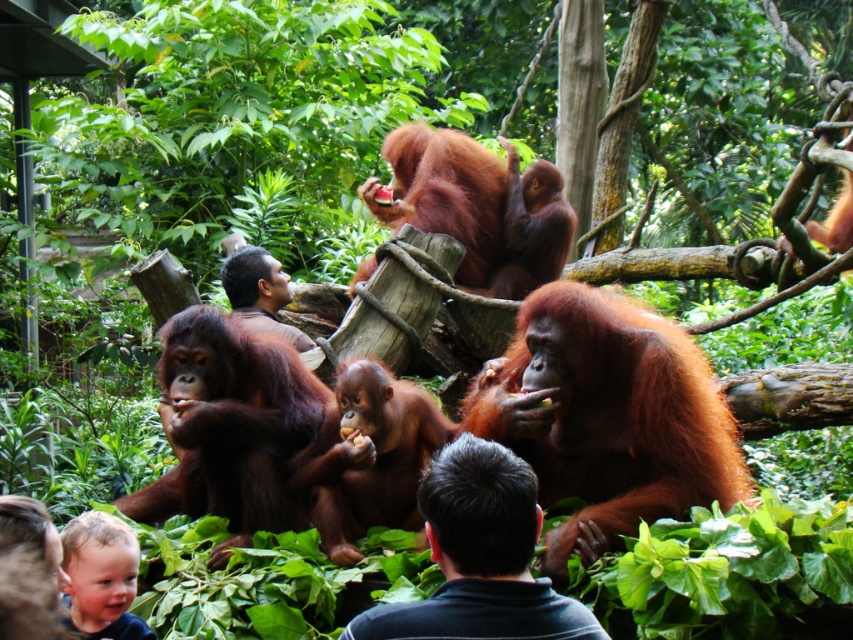
Between shiny brown fur at center and dark blue shirt at center, which one has less height?

Standing shorter between the two is shiny brown fur at center.

At what (x,y) coordinates should I click in order to perform the action: click on shiny brown fur at center. Please return your answer as a coordinate pair (x, y). This screenshot has height=640, width=853. Looking at the image, I should click on (606, 417).

Where is `dark blue shirt at center`? The image size is (853, 640). dark blue shirt at center is located at coordinates (480, 556).

Who is higher up, dark blue shirt at center or blonde hair at lower left?

dark blue shirt at center

Is point (358, 636) positioned behind point (107, 572)?

No, (358, 636) is closer to viewer.

You are a GUI agent. You are given a task and a screenshot of the screen. Output one action in this format:
    pyautogui.click(x=<x>, y=<y>)
    Task: Click on the dark blue shirt at center
    This screenshot has height=640, width=853.
    Given the screenshot: What is the action you would take?
    pyautogui.click(x=480, y=556)

Who is positioned more to the left, shiny brown fur at center or blonde hair at lower left?

blonde hair at lower left is more to the left.

Does point (566, 440) lie behind point (97, 588)?

Yes.

Find the location of a particular element. The image size is (853, 640). shiny brown fur at center is located at coordinates (606, 417).